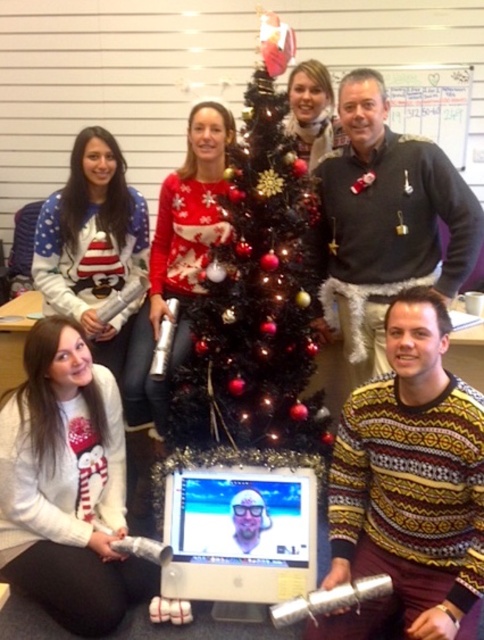
You are a photographer taking a group photo. You notice the yellow and brown sweater at center and the white knit sweater at lower left. Which person should you ask to move closer to ensure both are in focus? Explain your reasoning.

The yellow and brown sweater at center is much taller than the white knit sweater at lower left. To ensure both are in focus, you should ask the person wearing the white knit sweater at lower left to move closer to the camera so they align in height with the taller individual in the yellow and brown sweater at center.

You are organizing a holiday party and need to place a 1.8 meter tall artificial tree in the office. The shiny metallic christmas tree at center is currently in the way. Can you move it to the corner where the white knit sweater at lower left is located without bending it?

The shiny metallic christmas tree at center is taller than the white knit sweater at lower left. Since the tree is taller, moving it upright might not be possible without bending it, so you should consider moving it horizontally or disassembling it first.

You are an office worker who needs to place a 17 inch wide box on your desk. You see the shiny metallic christmas tree at center and the white glossy monitor at center. Can you fit the box between them?

The distance between the shiny metallic christmas tree at center and the white glossy monitor at center is 16.59 inches, which is less than the 17 inch wide box. Therefore, the box cannot fit between them.